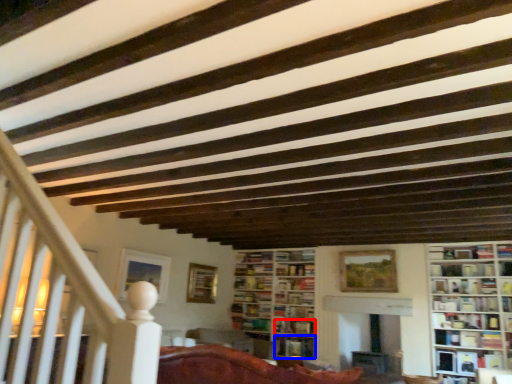
Question: Which object appears farthest to the camera in this image, book (highlighted by a red box) or book (highlighted by a blue box)?

Choices:
 (A) book
 (B) book

Answer: (A)